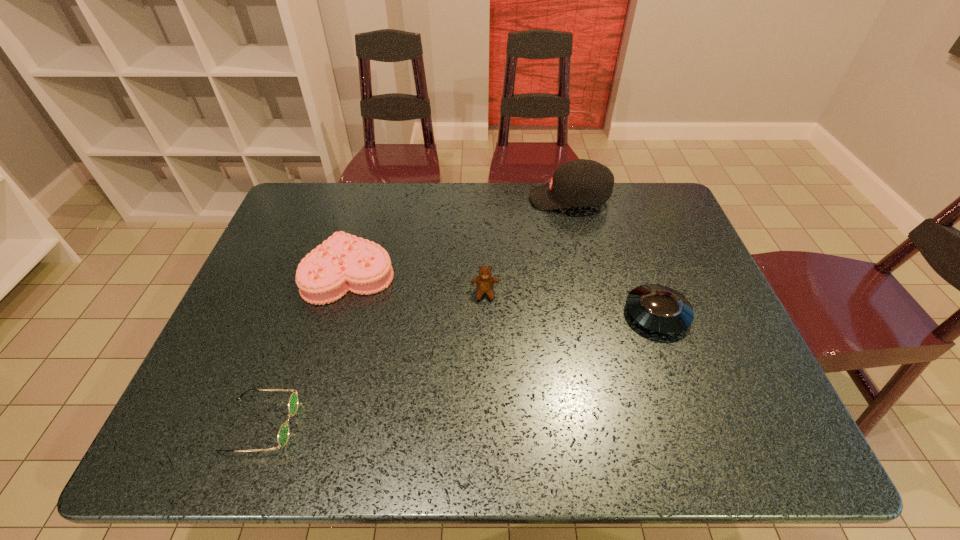
The image size is (960, 540). Identify the location of vacant area situated 0.300m with a logo on the front of the baseball cap. (438, 199).

You are a GUI agent. You are given a task and a screenshot of the screen. Output one action in this format:
    pyautogui.click(x=<x>, y=<y>)
    Task: Click on the vacant space located 0.340m at the face of the teddy bear
    
    Given the screenshot: What is the action you would take?
    pyautogui.click(x=487, y=428)

The width and height of the screenshot is (960, 540). I want to click on vacant position located on the front of the cake, so click(x=316, y=390).

The image size is (960, 540). Identify the location of blank space located on the back of the saucer. (641, 269).

I want to click on vacant space located on the lenses of the shortest object, so click(484, 424).

Identify the location of object positioned at the far edge. This screenshot has width=960, height=540. (578, 183).

Identify the location of object that is positioned at the near edge. This screenshot has width=960, height=540. (283, 433).

This screenshot has width=960, height=540. I want to click on cake that is at the left edge, so click(343, 262).

Locate an element on the screen. The image size is (960, 540). spectacles present at the left edge is located at coordinates (283, 433).

This screenshot has width=960, height=540. I want to click on object that is at the right edge, so click(x=658, y=308).